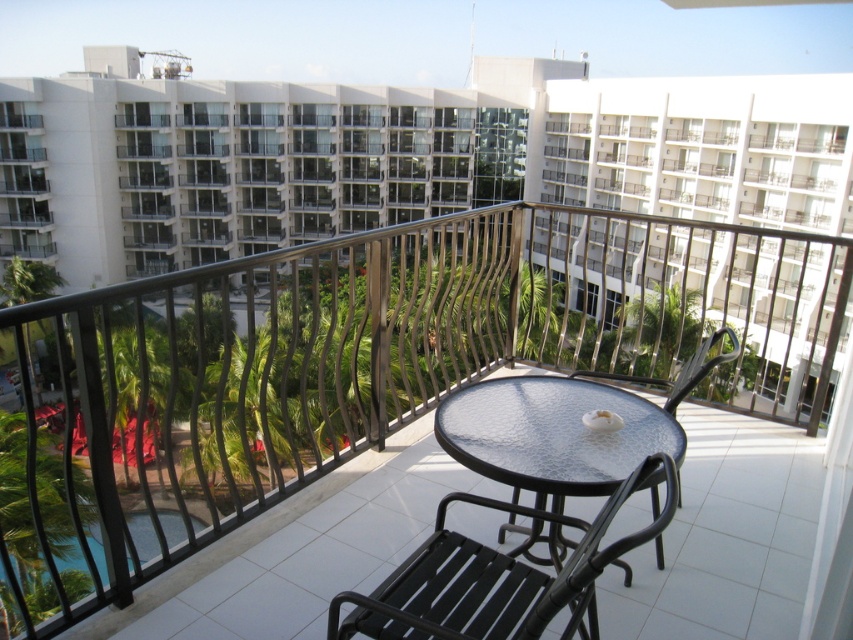
Question: Which of the following is the farthest from the observer?

Choices:
 (A) clear glass pool at lower left
 (B) metallic glass table at center

Answer: (A)

Question: Does textured glass table at center appear over black metal chair at lower right?

Choices:
 (A) no
 (B) yes

Answer: (B)

Question: Is textured glass table at center further to the viewer compared to black metal chair at lower right?

Choices:
 (A) no
 (B) yes

Answer: (B)

Question: Which point is farther to the camera?

Choices:
 (A) black metal chair at lower right
 (B) textured glass table at center
 (C) metallic glass table at center

Answer: (C)

Question: Estimate the real-world distances between objects in this image. Which object is closer to the clear glass pool at lower left?

Choices:
 (A) textured glass table at center
 (B) metallic glass table at center
 (C) black metal chair at lower right

Answer: (C)

Question: Can you confirm if black metal chair at lower right is smaller than clear glass pool at lower left?

Choices:
 (A) no
 (B) yes

Answer: (B)